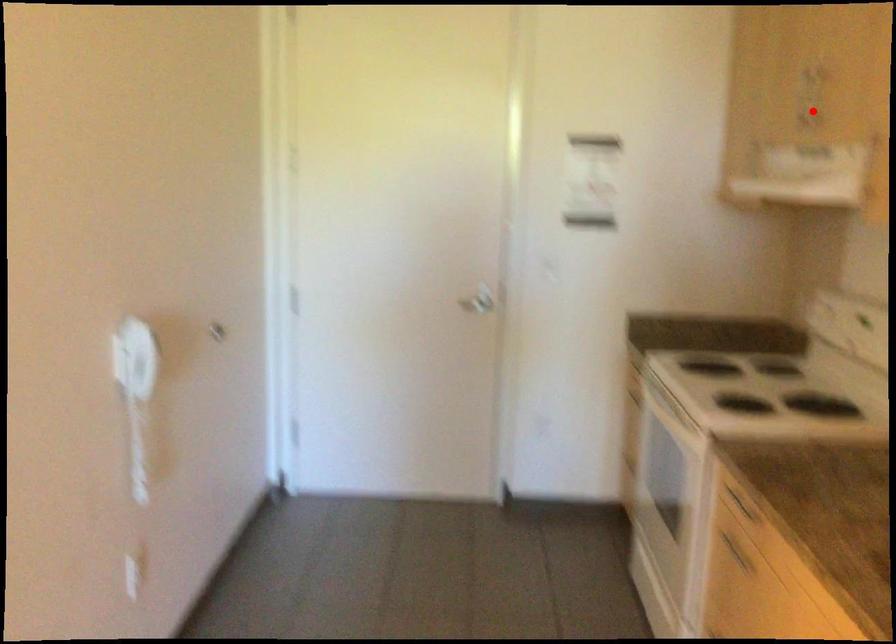
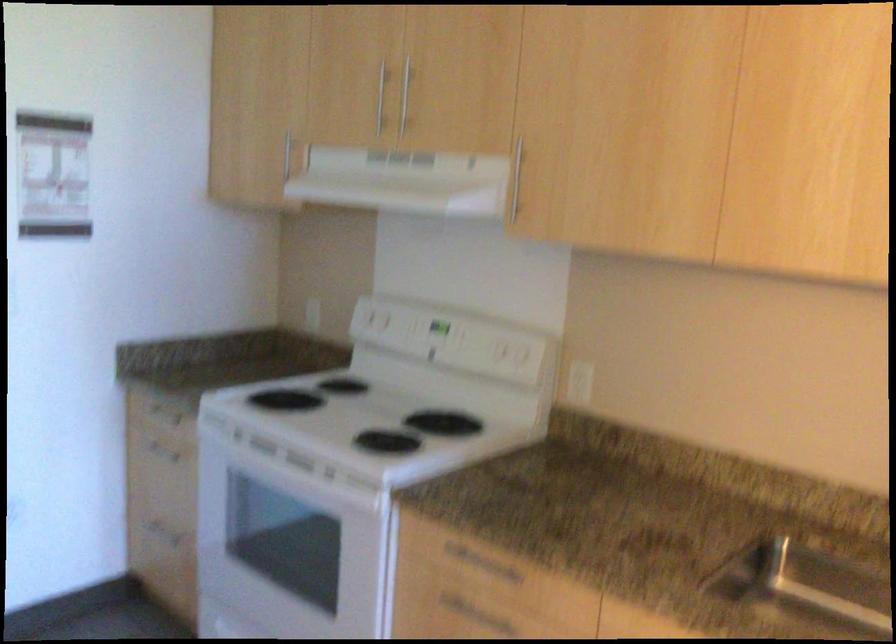
Question: I am providing you with two images of the same scene from different viewpoints. A red point is shown in image1. For the corresponding object point in image2, is it positioned nearer or farther from the camera?

Choices:
 (A) Nearer
 (B) Farther

Answer: (A)